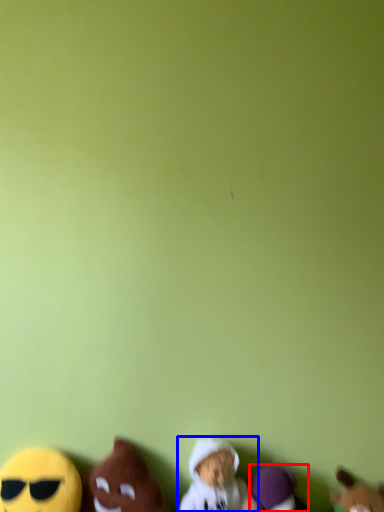
Question: Which point is closer to the camera, toy (highlighted by a red box) or toy (highlighted by a blue box)?

Choices:
 (A) toy
 (B) toy

Answer: (B)